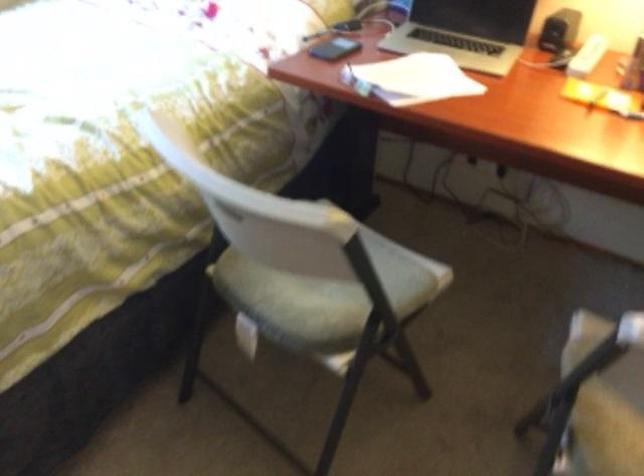
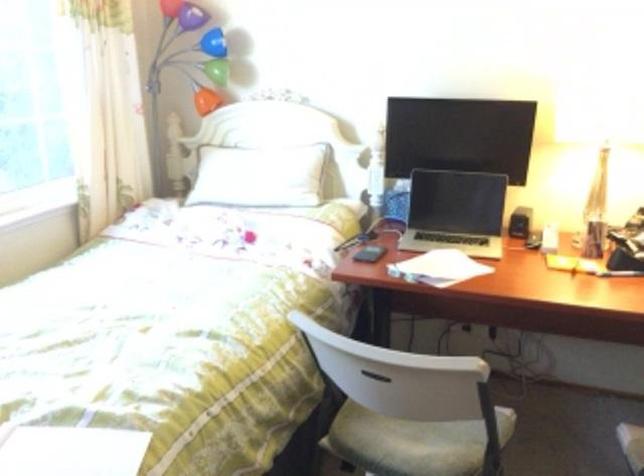
Where in the second image is the point corresponding to (x=308, y=288) from the first image?

(413, 442)